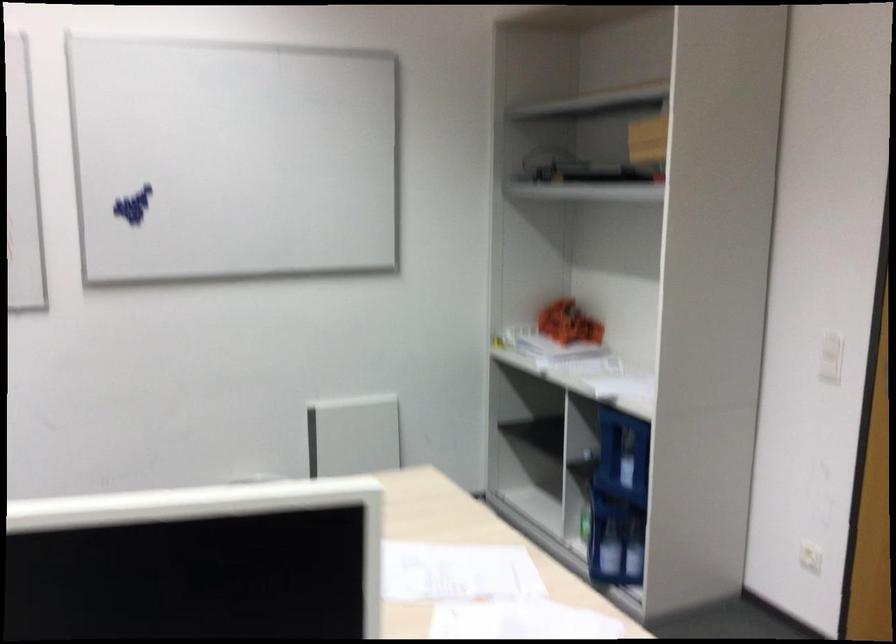
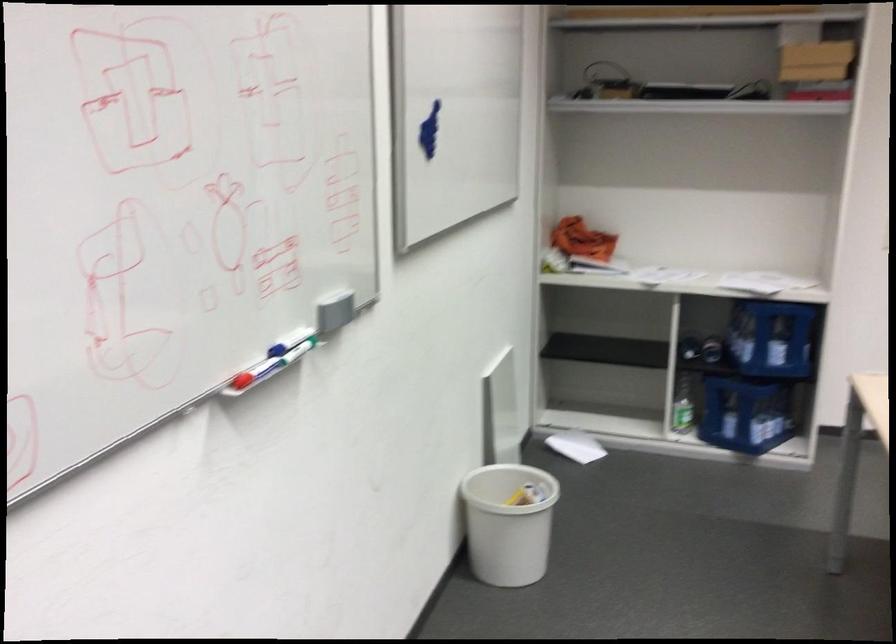
Find the pixel in the second image that matches point (698, 446) in the first image.

(771, 337)